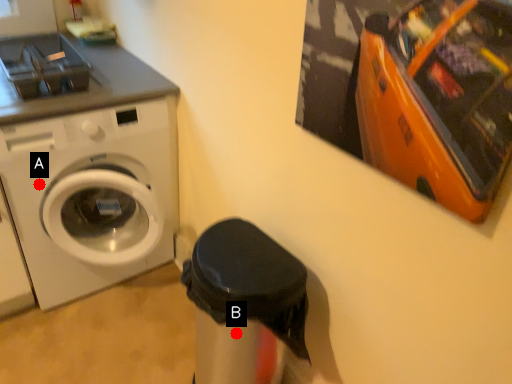
Question: Two points are circled on the image, labeled by A and B beside each circle. Which point is farther from the camera taking this photo?

Choices:
 (A) A is further
 (B) B is further

Answer: (A)